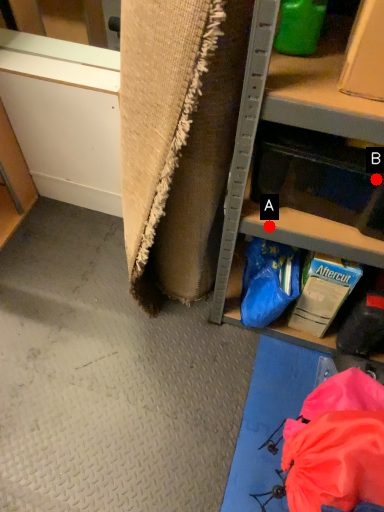
Question: Two points are circled on the image, labeled by A and B beside each circle. Which point is farther from the camera taking this photo?

Choices:
 (A) A is further
 (B) B is further

Answer: (A)